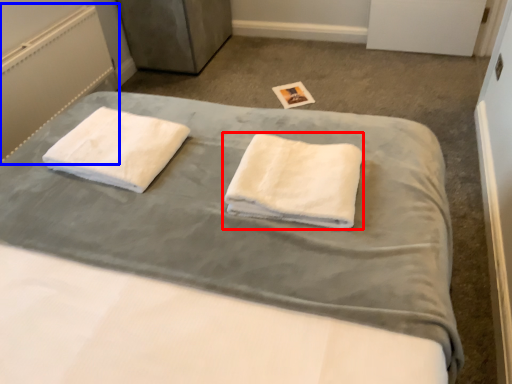
Question: Which point is further to the camera, towel (highlighted by a red box) or radiator (highlighted by a blue box)?

Choices:
 (A) towel
 (B) radiator

Answer: (B)